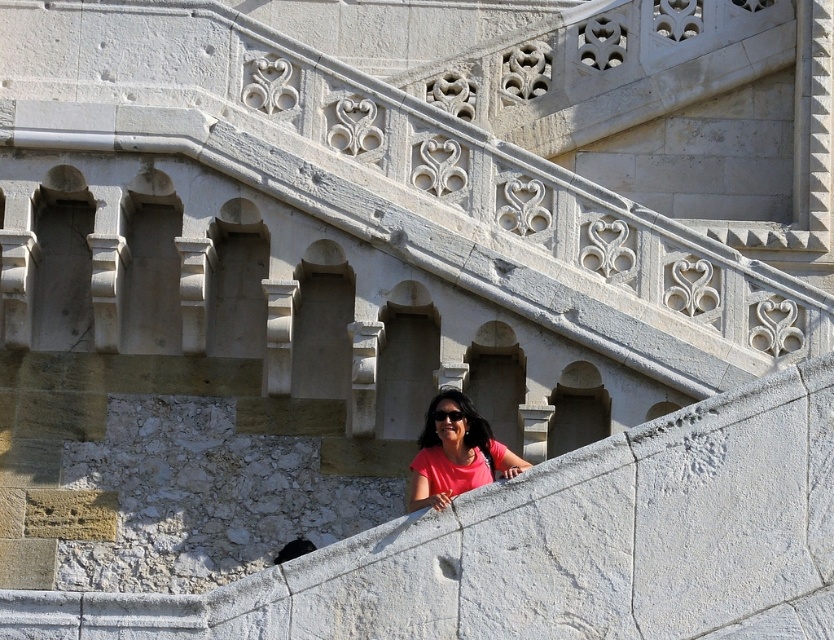
Is point (418, 506) positioned before point (438, 412)?

That is True.

Is pink matte shirt at center bigger than black plastic goggles at center?

Correct, pink matte shirt at center is larger in size than black plastic goggles at center.

Describe the element at coordinates (456, 454) in the screenshot. The height and width of the screenshot is (640, 834). I see `pink matte shirt at center` at that location.

This screenshot has height=640, width=834. In order to click on pink matte shirt at center in this screenshot , I will do click(456, 454).